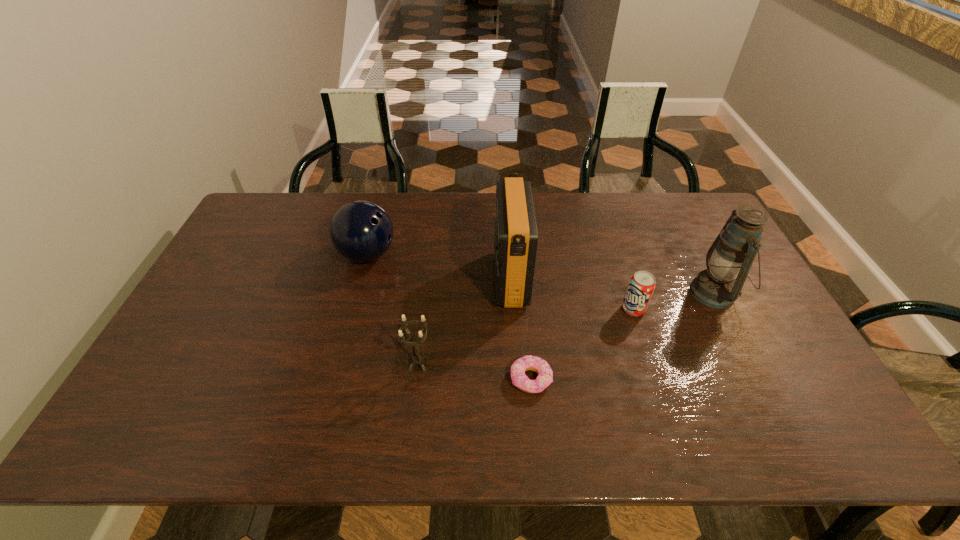
I want to click on vacant space that satisfies the following two spatial constraints: 1. on the front-facing side of the radio receiver; 2. on the left side of the doughnut, so click(516, 379).

The width and height of the screenshot is (960, 540). I want to click on vacant space that satisfies the following two spatial constraints: 1. on the front-facing side of the rightmost object; 2. on the right side of the radio receiver, so click(511, 293).